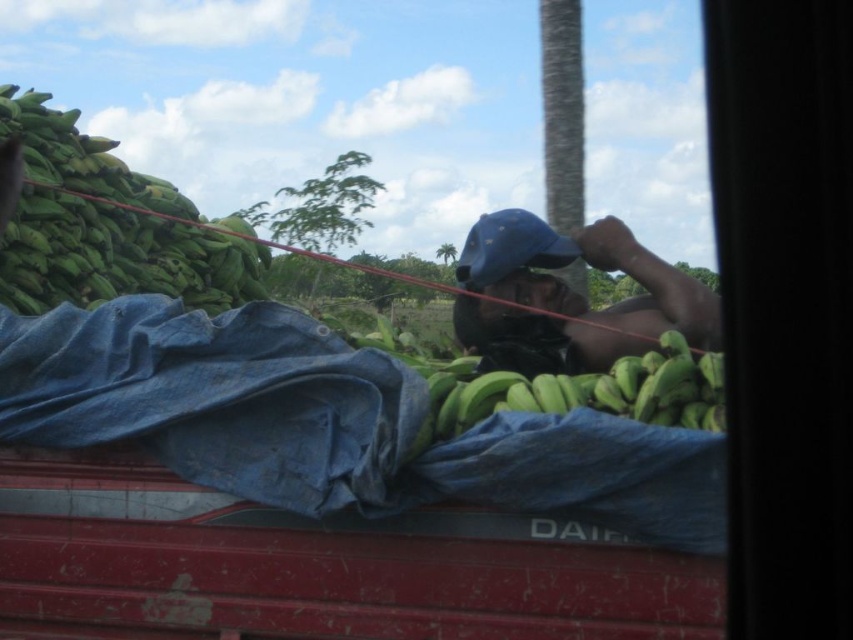
You are a passenger in the vehicle and notice the blue fabric cap at center. If you want to point to its exact location, what coordinates would you use?

The coordinates for the blue fabric cap at center are at point (589, 264).

You are a passenger in the vehicle and notice the blue fabric cap at center and the green matte bananas at center. Which object is taller from your viewpoint?

The blue fabric cap at center is much taller than the green matte bananas at center.

You are a delivery driver who needs to ensure the bananas are within the vehicle for transport. The bananas must be at least 6 meters away from the camera to be safely secured. Are the green matte bananas at upper left positioned safely?

The green matte bananas at upper left are only 5.94 meters away from the camera, which is less than the required 6 meters. Therefore, they are not positioned safely and may need to be moved further back to ensure proper securing during transport.